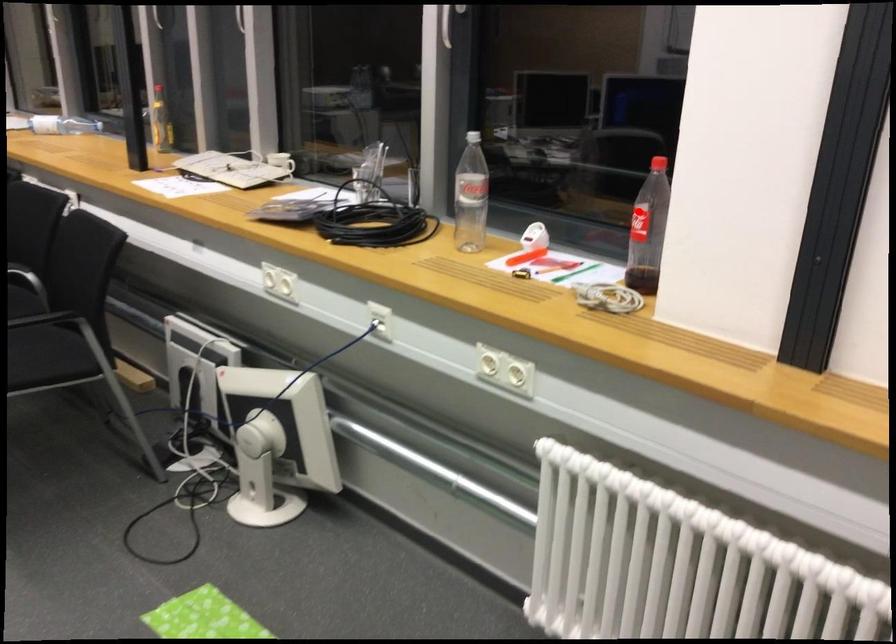
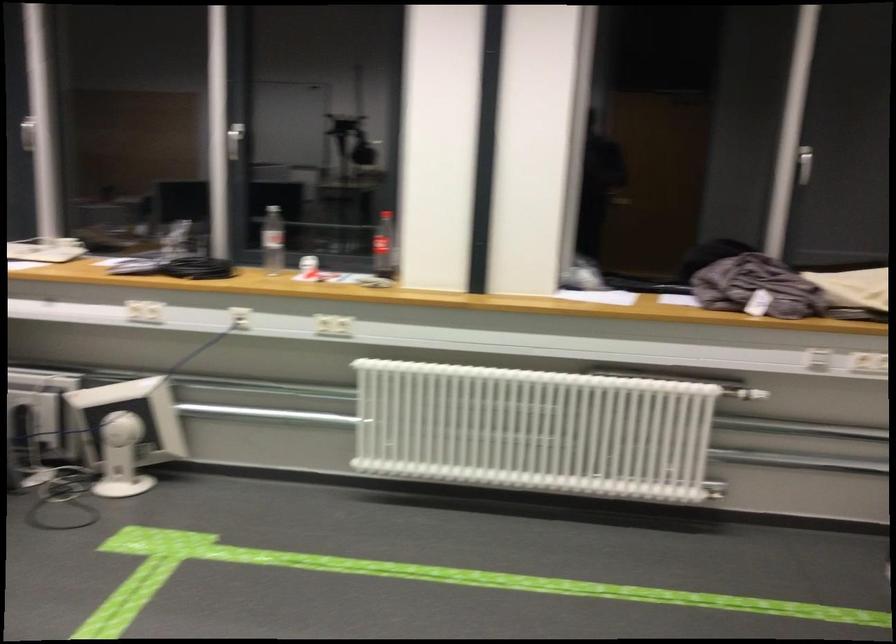
Locate, in the second image, the point that corresponds to the highlighted location in the first image.

(383, 245)